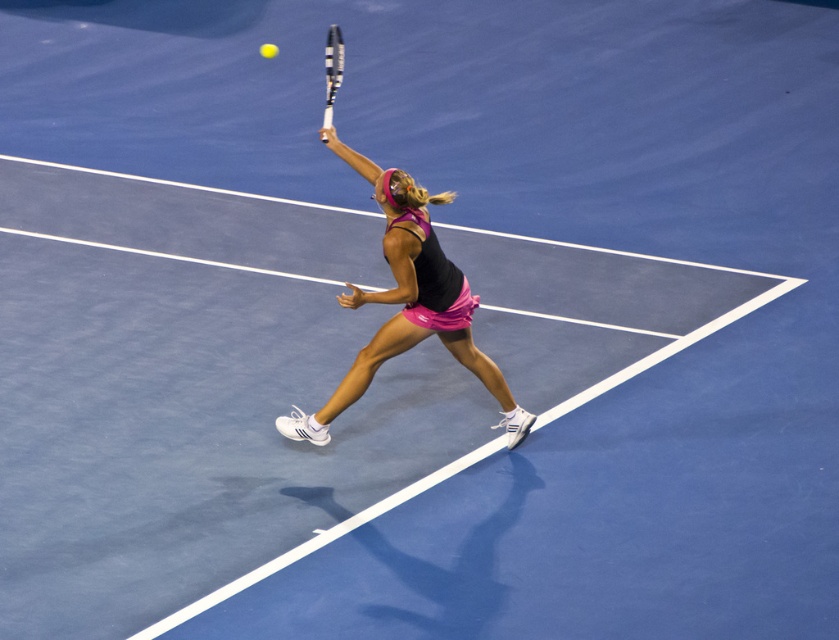
Can you confirm if pink fabric tennis skirt at center is wider than white textured tennis racket at upper center?

Yes.

Between point (399, 253) and point (326, 84), which one is positioned in front?

Positioned in front is point (399, 253).

Is point (353, 292) more distant than point (342, 58)?

No, (353, 292) is closer to viewer.

This screenshot has height=640, width=839. Identify the location of pink fabric tennis skirt at center. (408, 304).